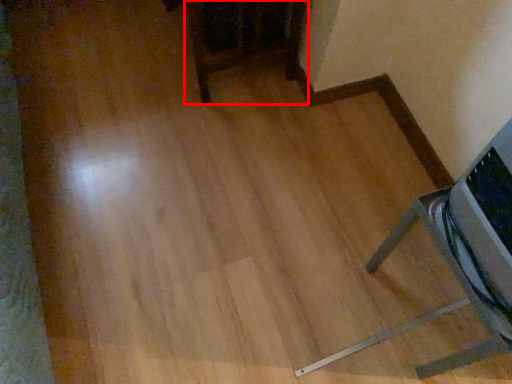
Question: From the image, what is the correct spatial relationship of furniture (annotated by the red box) in relation to furniture?

Choices:
 (A) right
 (B) left

Answer: (B)